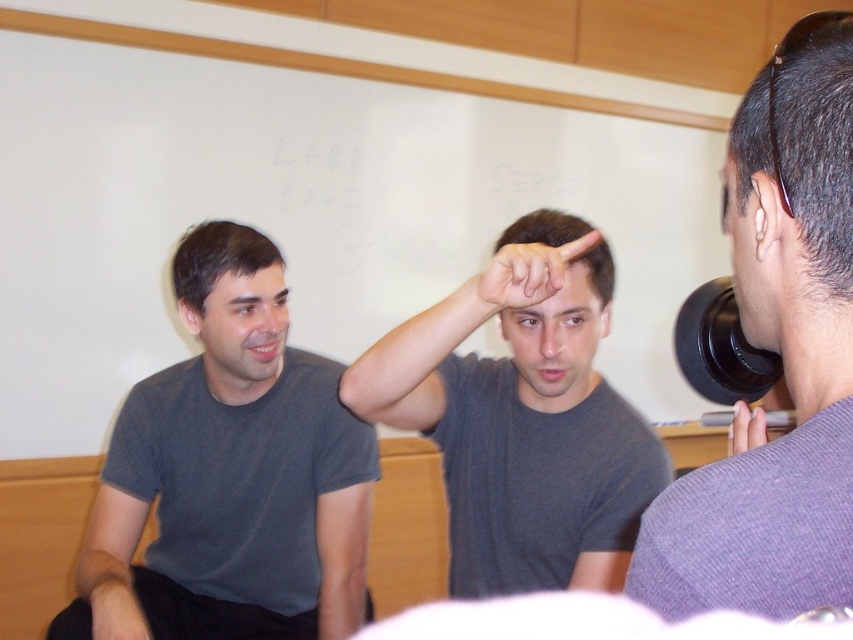
Question: Does matte gray forehead at center have a greater width compared to matte gray ear at upper center?

Choices:
 (A) yes
 (B) no

Answer: (A)

Question: Is matte black hand at upper right thinner than matte gray ear at upper center?

Choices:
 (A) no
 (B) yes

Answer: (A)

Question: Which point is closer to the camera?

Choices:
 (A) light skin/soft tissue ear at upper right
 (B) purple matte shirt at right
 (C) matte gray ear at upper center
 (D) matte gray hand at center

Answer: (B)

Question: Which point is farther to the camera?

Choices:
 (A) matte black hand at upper right
 (B) purple matte shirt at right
 (C) gray matte t-shirt at left

Answer: (C)

Question: Among these points, which one is nearest to the camera?

Choices:
 (A) (587, 250)
 (B) (242, 294)
 (C) (747, 252)
 (D) (743, 426)

Answer: (C)

Question: Does purple matte shirt at right appear under matte gray forehead at center?

Choices:
 (A) yes
 (B) no

Answer: (A)